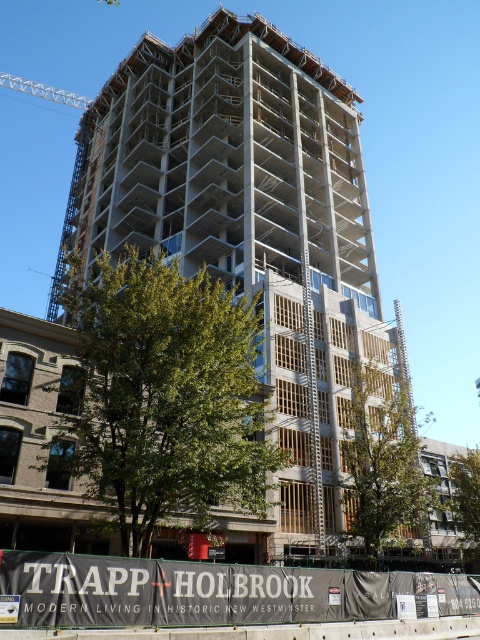
Who is higher up, gray concrete construction site at center or white metallic crane at upper left?

white metallic crane at upper left is above.

Is gray concrete construction site at center below white metallic crane at upper left?

Correct, gray concrete construction site at center is located below white metallic crane at upper left.

You are a GUI agent. You are given a task and a screenshot of the screen. Output one action in this format:
    pyautogui.click(x=<x>, y=<y>)
    Task: Click on the gray concrete construction site at center
    Image resolution: width=480 pixels, height=640 pixels.
    Given the screenshot: What is the action you would take?
    pyautogui.click(x=210, y=592)

Based on the photo, between white concrete building at center and gray concrete construction site at center, which one has less height?

gray concrete construction site at center is shorter.

Is white concrete building at center smaller than gray concrete construction site at center?

No.

Does point (311, 113) come behind point (46, 616)?

That is True.

The height and width of the screenshot is (640, 480). What are the coordinates of `white concrete building at center` in the screenshot? It's located at (248, 220).

Looking at this image, does white concrete building at center have a greater height compared to white metallic crane at upper left?

Yes.

Does white concrete building at center have a larger size compared to white metallic crane at upper left?

Yes.

Between point (305, 81) and point (10, 74), which one is positioned behind?

The point (10, 74) is more distant.

In order to click on white concrete building at center in this screenshot , I will do `click(248, 220)`.